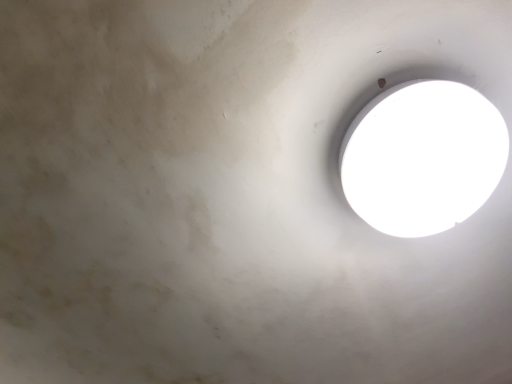
In order to face white glossy lamp at upper center, should I rotate leftwards or rightwards?

Rotate your view right by about 21.313°.

In order to click on white glossy lamp at upper center in this screenshot , I will do `click(423, 157)`.

What do you see at coordinates (423, 157) in the screenshot? This screenshot has height=384, width=512. I see `white glossy lamp at upper center` at bounding box center [423, 157].

Locate an element on the screen. The width and height of the screenshot is (512, 384). white glossy lamp at upper center is located at coordinates pyautogui.click(x=423, y=157).